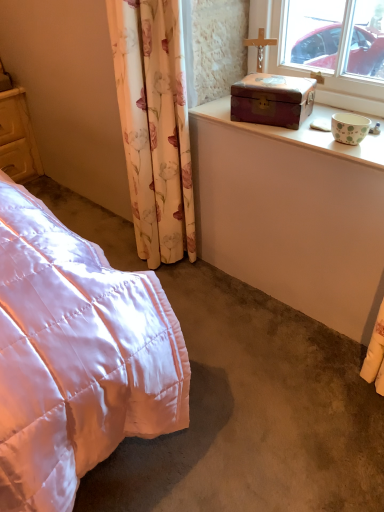
In order to face matte yellow wooden cupboard at left, should I rotate leftwards or rightwards?

Rotate left and turn 25.132 degrees.

The height and width of the screenshot is (512, 384). What do you see at coordinates (272, 100) in the screenshot? I see `wooden box at upper right` at bounding box center [272, 100].

Locate an element on the screen. Image resolution: width=384 pixels, height=512 pixels. floral fabric curtain at left is located at coordinates (154, 125).

Could you tell me if matte yellow wooden cupboard at left is facing wooden box at upper right?

Yes, matte yellow wooden cupboard at left is oriented towards wooden box at upper right.

Locate an element on the screen. box in front of the matte yellow wooden cupboard at left is located at coordinates (272, 100).

From the image's perspective, is matte yellow wooden cupboard at left located beneath wooden box at upper right?

A: Incorrect, from the image's perspective, matte yellow wooden cupboard at left is higher than wooden box at upper right.

From a real-world perspective, which object rests below the other?

floral fabric curtain at left.

Is point (308, 82) positioned in front of point (119, 23)?

No, (308, 82) is behind (119, 23).

Which object is further away from the camera, wooden box at upper right or floral fabric curtain at left?

wooden box at upper right is behind.

Based on the photo, from a real-world perspective, who is located lower, wooden chest at upper right or matte yellow wooden cupboard at left?

matte yellow wooden cupboard at left, from a real-world perspective.

Considering the positions of point (314, 113) and point (15, 137), is point (314, 113) closer or farther from the camera than point (15, 137)?

Point (314, 113) appears to be closer to the viewer than point (15, 137).

Is wooden chest at upper right to the left or to the right of matte yellow wooden cupboard at left in the image?

wooden chest at upper right is to the right of matte yellow wooden cupboard at left.

Looking at this image, can we say wooden box at upper right lies outside matte yellow wooden cupboard at left?

Yes, wooden box at upper right is located beyond the bounds of matte yellow wooden cupboard at left.

Is wooden box at upper right aimed at matte yellow wooden cupboard at left?

No.

Is point (272, 115) closer to camera compared to point (7, 118)?

Yes.

Considering the points (110, 18) and (313, 103), which point is behind, point (110, 18) or point (313, 103)?

The point (313, 103) is more distant.

From the image's perspective, relative to wooden box at upper right, is floral fabric curtain at left above or below?

Based on their image positions, floral fabric curtain at left is located beneath wooden box at upper right.

Looking at this image, in terms of size, does floral fabric curtain at left appear bigger or smaller than wooden box at upper right?

In the image, floral fabric curtain at left appears to be larger than wooden box at upper right.

From the image's perspective, which is below, wooden chest at upper right or floral fabric curtain at left?

floral fabric curtain at left is shown below in the image.

Is point (283, 129) positioned in front of point (136, 174)?

Yes.

Between wooden chest at upper right and floral fabric curtain at left, which one has smaller width?

floral fabric curtain at left.

Does floral fabric curtain at left come behind matte yellow wooden cupboard at left?

No, it is in front of matte yellow wooden cupboard at left.

Is floral fabric curtain at left not close to matte yellow wooden cupboard at left?

Yes, floral fabric curtain at left and matte yellow wooden cupboard at left are quite far apart.

Is floral fabric curtain at left bigger than matte yellow wooden cupboard at left?

Correct, floral fabric curtain at left is larger in size than matte yellow wooden cupboard at left.

Find the location of a particular element. box above the matte yellow wooden cupboard at left (from a real-world perspective) is located at coordinates (272, 100).

I want to click on curtain located on the left of wooden box at upper right, so click(x=154, y=125).

Estimate the real-world distances between objects in this image. Which object is further from floral fabric curtain at left, matte yellow wooden cupboard at left or wooden box at upper right?

matte yellow wooden cupboard at left is further to floral fabric curtain at left.

Which object lies further to the anchor point wooden chest at upper right, matte yellow wooden cupboard at left or floral fabric curtain at left?

Based on the image, matte yellow wooden cupboard at left appears to be further to wooden chest at upper right.

Considering their positions, is matte yellow wooden cupboard at left positioned closer to floral fabric curtain at left than wooden chest at upper right?

wooden chest at upper right lies closer to floral fabric curtain at left than the other object.

When comparing their distances from wooden box at upper right, does wooden chest at upper right or floral fabric curtain at left seem closer?

wooden chest at upper right lies closer to wooden box at upper right than the other object.

Based on their spatial positions, is wooden box at upper right or wooden chest at upper right closer to floral fabric curtain at left?

wooden chest at upper right lies closer to floral fabric curtain at left than the other object.

When comparing their distances from wooden chest at upper right, does floral fabric curtain at left or matte yellow wooden cupboard at left seem closer?

floral fabric curtain at left is closer to wooden chest at upper right.

Estimate the real-world distances between objects in this image. Which object is further from wooden box at upper right, floral fabric curtain at left or wooden chest at upper right?

Based on the image, floral fabric curtain at left appears to be further to wooden box at upper right.

Estimate the real-world distances between objects in this image. Which object is further from wooden box at upper right, wooden chest at upper right or matte yellow wooden cupboard at left?

matte yellow wooden cupboard at left is further to wooden box at upper right.

You are a GUI agent. You are given a task and a screenshot of the screen. Output one action in this format:
    pyautogui.click(x=<x>, y=<y>)
    Task: Click on the curtain between matte yellow wooden cupboard at left and wooden chest at upper right
    The image size is (384, 512).
    Given the screenshot: What is the action you would take?
    pyautogui.click(x=154, y=125)

Identify the location of box between matte yellow wooden cupboard at left and wooden chest at upper right in the horizontal direction. The image size is (384, 512). (272, 100).

Locate an element on the screen. box situated between floral fabric curtain at left and wooden chest at upper right from left to right is located at coordinates (272, 100).

At what (x,y) coordinates should I click in order to perform the action: click on curtain located between matte yellow wooden cupboard at left and wooden box at upper right in the left-right direction. Please return your answer as a coordinate pair (x, y). The image size is (384, 512). Looking at the image, I should click on (154, 125).